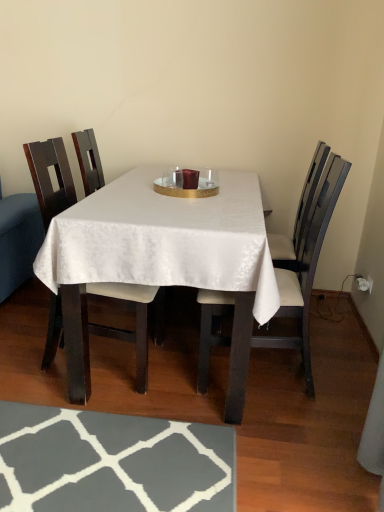
Question: Is matte wood chair at left, arranged as the 1th chair when viewed from the left, at the left side of wooden chair at center, which ranks as the first chair in right-to-left order?

Choices:
 (A) yes
 (B) no

Answer: (A)

Question: Can we say matte wood chair at left, which is the 2th chair from right to left, lies outside wooden chair at center, which ranks as the first chair in right-to-left order?

Choices:
 (A) no
 (B) yes

Answer: (B)

Question: Considering the relative positions of matte wood chair at left, which is the 2th chair from right to left, and wooden chair at center, which is the 2th chair in left-to-right order, in the image provided, is matte wood chair at left, which is the 2th chair from right to left, in front of wooden chair at center, which is the 2th chair in left-to-right order,?

Choices:
 (A) no
 (B) yes

Answer: (A)

Question: Considering the relative sizes of matte wood chair at left, which is the 2th chair from right to left, and wooden chair at center, which ranks as the first chair in right-to-left order, in the image provided, is matte wood chair at left, which is the 2th chair from right to left, wider than wooden chair at center, which ranks as the first chair in right-to-left order,?

Choices:
 (A) yes
 (B) no

Answer: (B)

Question: From a real-world perspective, is matte wood chair at left, arranged as the 1th chair when viewed from the left, positioned under wooden chair at center, which ranks as the first chair in right-to-left order, based on gravity?

Choices:
 (A) no
 (B) yes

Answer: (B)

Question: Is matte wood chair at left, arranged as the 1th chair when viewed from the left, oriented towards wooden chair at center, which ranks as the first chair in right-to-left order?

Choices:
 (A) no
 (B) yes

Answer: (B)

Question: Does white satin table at center have a lesser width compared to wooden chair at center, which is the 2th chair in left-to-right order?

Choices:
 (A) no
 (B) yes

Answer: (A)

Question: Considering the relative positions of white satin table at center and wooden chair at center, which is the 2th chair in left-to-right order, in the image provided, is white satin table at center behind wooden chair at center, which is the 2th chair in left-to-right order,?

Choices:
 (A) no
 (B) yes

Answer: (A)

Question: Considering the relative sizes of white satin table at center and wooden chair at center, which ranks as the first chair in right-to-left order, in the image provided, is white satin table at center shorter than wooden chair at center, which ranks as the first chair in right-to-left order,?

Choices:
 (A) yes
 (B) no

Answer: (A)

Question: Is white satin table at center smaller than wooden chair at center, which ranks as the first chair in right-to-left order?

Choices:
 (A) yes
 (B) no

Answer: (B)

Question: Can you confirm if white satin table at center is taller than wooden chair at center, which ranks as the first chair in right-to-left order?

Choices:
 (A) yes
 (B) no

Answer: (B)

Question: From the image's perspective, would you say white satin table at center is shown under wooden chair at center, which is the 2th chair in left-to-right order?

Choices:
 (A) yes
 (B) no

Answer: (B)

Question: Is white satin table at center surrounded by wooden chair at center, which is the 2th chair in left-to-right order?

Choices:
 (A) no
 (B) yes

Answer: (A)